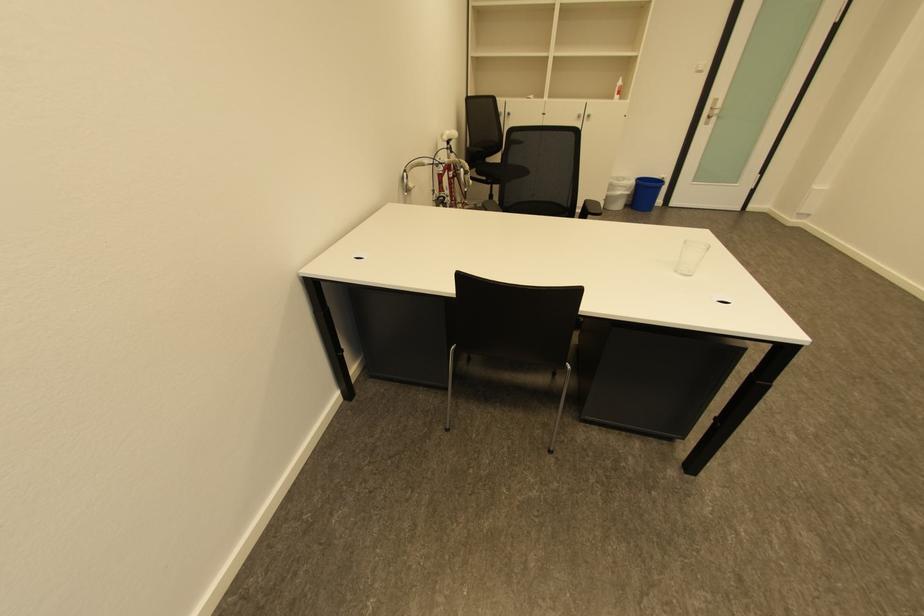
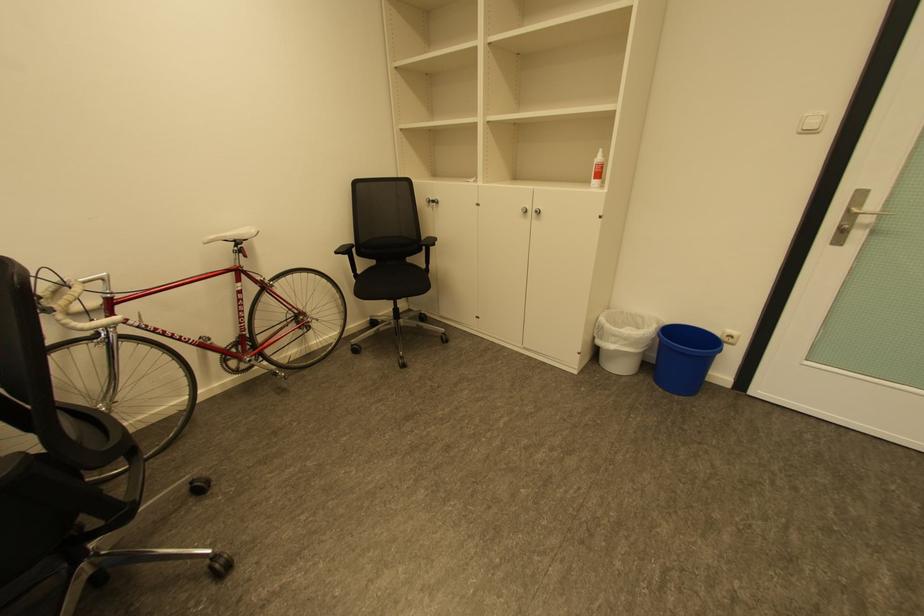
Which direction would the cameraman need to move to produce the second image?

The cameraman walked toward right, forward.